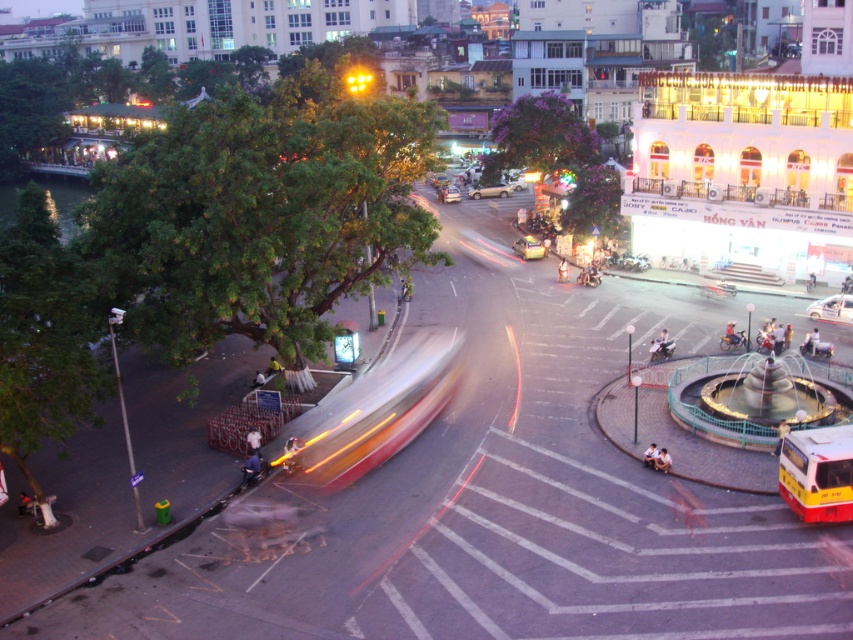
Question: Does gold metallic sedan at center appear under yellow metallic car at center?

Choices:
 (A) yes
 (B) no

Answer: (A)

Question: Among these points, which one is farthest from the camera?

Choices:
 (A) (469, 193)
 (B) (801, 481)

Answer: (A)

Question: Can you confirm if yellow matte bus at lower right is positioned to the left of metallic silver car at center?

Choices:
 (A) yes
 (B) no

Answer: (A)

Question: Which object appears closest to the camera in this image?

Choices:
 (A) yellow metallic car at center
 (B) metallic silver car at center
 (C) yellow matte bus at lower right
 (D) gold metallic sedan at center

Answer: (C)

Question: Does metallic silver car at center have a larger size compared to gold metallic sedan at center?

Choices:
 (A) no
 (B) yes

Answer: (A)

Question: Which of the following is the closest to the observer?

Choices:
 (A) (438, 198)
 (B) (503, 186)

Answer: (B)